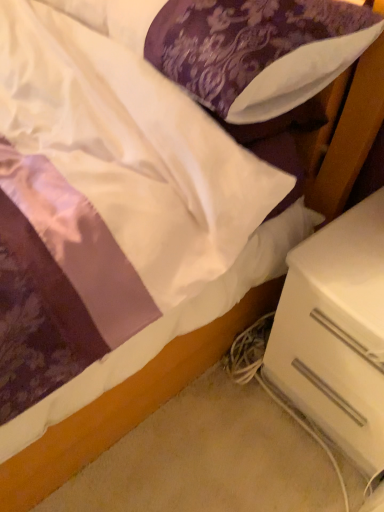
Question: From a real-world perspective, is white plastic drawer at lower right positioned above or below white satin pillow at upper center?

Choices:
 (A) below
 (B) above

Answer: (A)

Question: Is point (365, 378) closer or farther from the camera than point (195, 81)?

Choices:
 (A) closer
 (B) farther

Answer: (B)

Question: In terms of height, does white plastic drawer at lower right look taller or shorter compared to white satin pillow at upper center?

Choices:
 (A) short
 (B) tall

Answer: (B)

Question: In the image, is white satin pillow at upper center on the left side or the right side of white plastic drawer at lower right?

Choices:
 (A) left
 (B) right

Answer: (A)

Question: Is white satin pillow at upper center situated inside white plastic drawer at lower right or outside?

Choices:
 (A) outside
 (B) inside

Answer: (A)

Question: Is point (342, 13) closer or farther from the camera than point (369, 392)?

Choices:
 (A) closer
 (B) farther

Answer: (A)

Question: From a real-world perspective, is white satin pillow at upper center above or below white plastic drawer at lower right?

Choices:
 (A) above
 (B) below

Answer: (A)